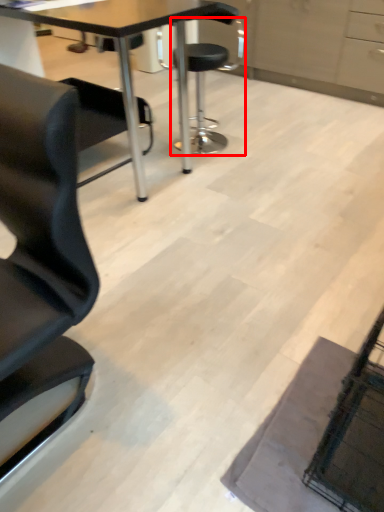
Question: From the image's perspective, what is the correct spatial positioning of chair (annotated by the red box) in reference to table?

Choices:
 (A) below
 (B) above

Answer: (B)